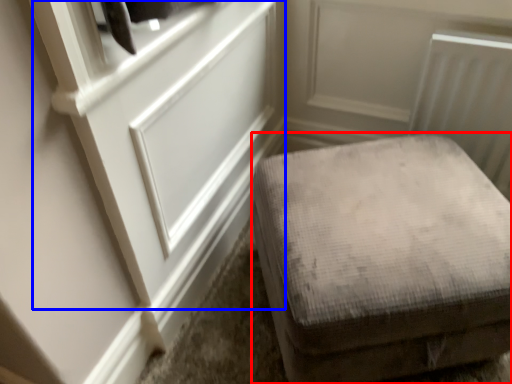
Question: Among these objects, which one is farthest to the camera, furniture (highlighted by a red box) or door (highlighted by a blue box)?

Choices:
 (A) furniture
 (B) door

Answer: (A)